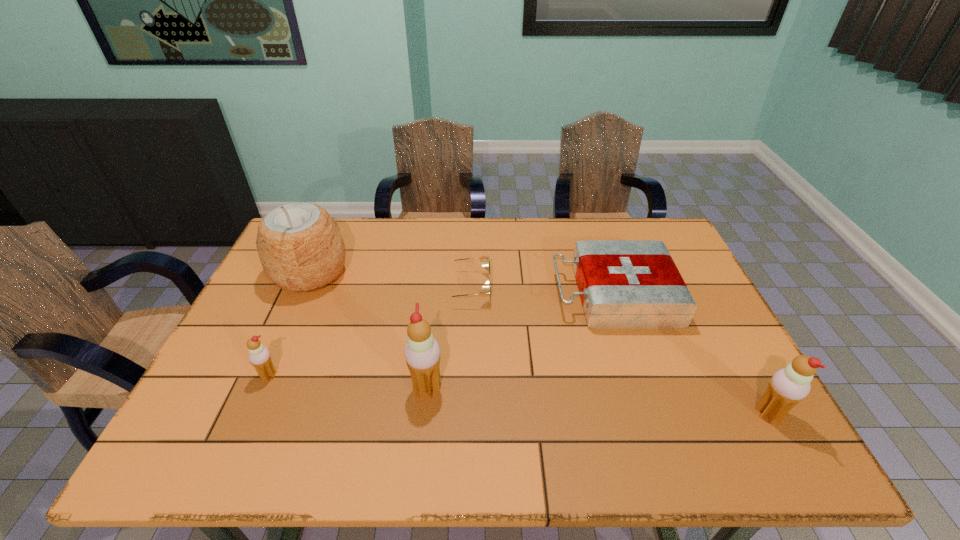
Identify the location of the shortest icecream. This screenshot has width=960, height=540. (259, 356).

At what (x,y) coordinates should I click in order to perform the action: click on the fourth tallest object. Please return your answer as a coordinate pair (x, y). This screenshot has height=540, width=960. Looking at the image, I should click on (259, 356).

Where is `the second icecream from right to left`? The height and width of the screenshot is (540, 960). the second icecream from right to left is located at coordinates (422, 352).

The width and height of the screenshot is (960, 540). What are the coordinates of `the third tallest object` in the screenshot? It's located at pyautogui.click(x=788, y=386).

Where is `the rightmost object`? the rightmost object is located at coordinates (788, 386).

Where is `sunglasses`? sunglasses is located at coordinates (485, 290).

The width and height of the screenshot is (960, 540). Find the location of `the tallest object`. the tallest object is located at coordinates (300, 246).

At what (x,y) coordinates should I click in order to perform the action: click on the fifth object from left to right. Please return your answer as a coordinate pair (x, y). This screenshot has height=540, width=960. Looking at the image, I should click on (624, 284).

At what (x,y) coordinates should I click in order to perform the action: click on free space located at the front with a straw on the third shortest object. Please return your answer as a coordinate pair (x, y). This screenshot has height=540, width=960. Looking at the image, I should click on (252, 413).

Locate an element on the screen. vacant space situated 0.350m at the front with a straw on the second icecream from right to left is located at coordinates (591, 387).